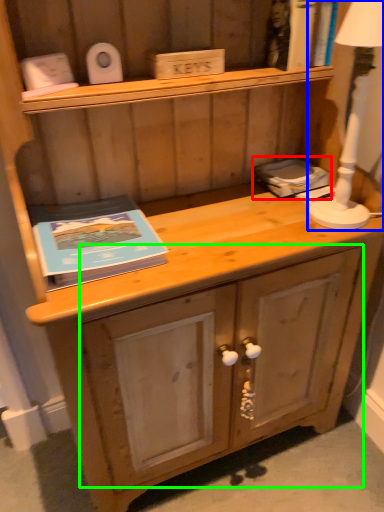
Question: Which is nearer to the book (highlighted by a red box)? bedside lamp (highlighted by a blue box) or drawer (highlighted by a green box).

Choices:
 (A) bedside lamp
 (B) drawer

Answer: (A)